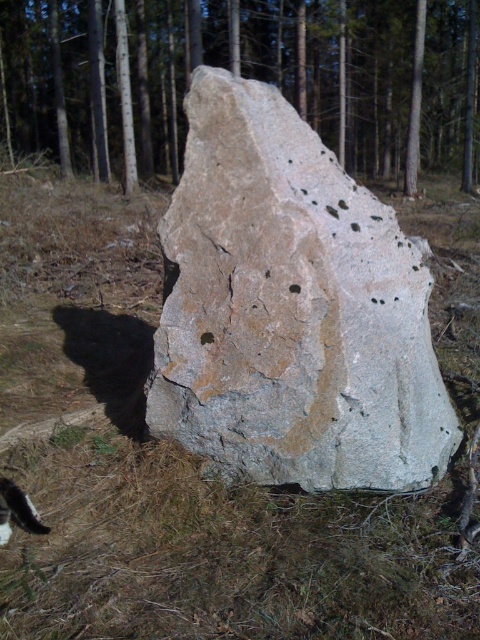
You are a geologist examining the rock formation shown. You notice the speckled stone at center and the brown rough rock at center. Which object is positioned lower in the scene?

The speckled stone at center is below the brown rough rock at center, so it is positioned lower in the scene.